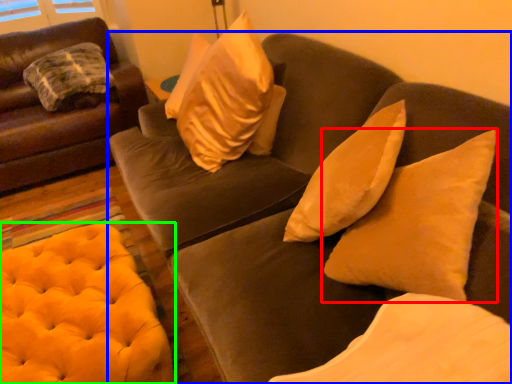
Question: Based on their relative distances, which object is nearer to pillow (highlighted by a red box)? Choose from studio couch (highlighted by a blue box) and stool (highlighted by a green box).

Choices:
 (A) studio couch
 (B) stool

Answer: (A)